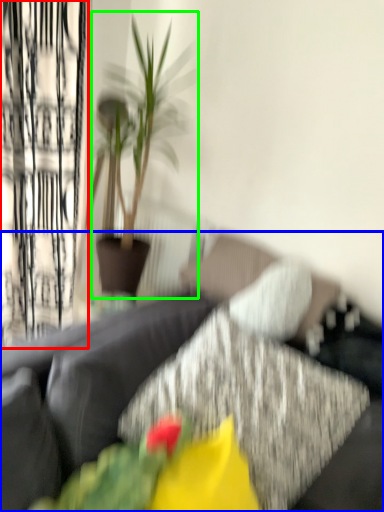
Question: Estimate the real-world distances between objects in this image. Which object is closer to curtain (highlighted by a red box), studio couch (highlighted by a blue box) or houseplant (highlighted by a green box)?

Choices:
 (A) studio couch
 (B) houseplant

Answer: (B)